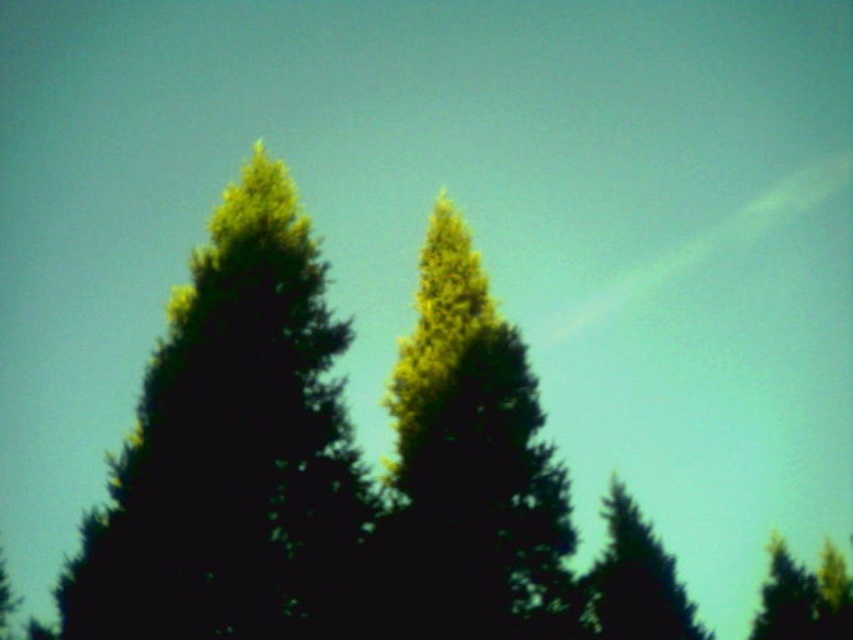
You are standing in a park and see the green matte fir tree at left. If you want to take a photo of it from a distance of exactly 50 feet, should you move closer or farther away?

The green matte fir tree at left is currently 52.23 feet away from you. To achieve a distance of exactly 50 feet, you should move closer to the tree by approximately 2.23 feet.